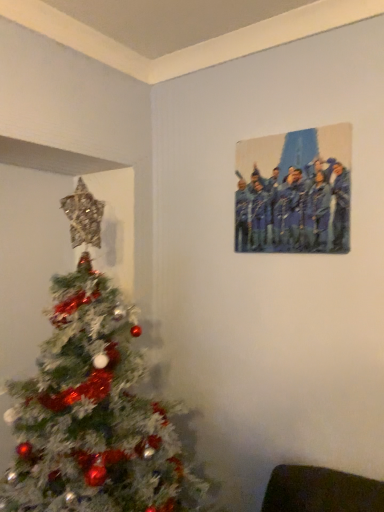
Question: From a real-world perspective, is shiny metallic christmas tree at left physically above metallic blue painting at upper right?

Choices:
 (A) no
 (B) yes

Answer: (A)

Question: Is shiny metallic christmas tree at left smaller than metallic blue painting at upper right?

Choices:
 (A) yes
 (B) no

Answer: (B)

Question: Is metallic blue painting at upper right a part of shiny metallic christmas tree at left?

Choices:
 (A) no
 (B) yes

Answer: (A)

Question: Is shiny metallic christmas tree at left next to metallic blue painting at upper right?

Choices:
 (A) yes
 (B) no

Answer: (B)

Question: From the image's perspective, is shiny metallic christmas tree at left below metallic blue painting at upper right?

Choices:
 (A) yes
 (B) no

Answer: (A)

Question: Does shiny metallic christmas tree at left have a lesser width compared to metallic blue painting at upper right?

Choices:
 (A) yes
 (B) no

Answer: (B)

Question: Is metallic blue painting at upper right positioned far away from shiny metallic christmas tree at left?

Choices:
 (A) no
 (B) yes

Answer: (A)

Question: From a real-world perspective, is metallic blue painting at upper right below shiny metallic christmas tree at left?

Choices:
 (A) yes
 (B) no

Answer: (B)

Question: Considering the relative sizes of metallic blue painting at upper right and shiny metallic christmas tree at left in the image provided, is metallic blue painting at upper right bigger than shiny metallic christmas tree at left?

Choices:
 (A) no
 (B) yes

Answer: (A)

Question: Does metallic blue painting at upper right have a greater height compared to shiny metallic christmas tree at left?

Choices:
 (A) no
 (B) yes

Answer: (A)

Question: Does metallic blue painting at upper right come in front of shiny metallic christmas tree at left?

Choices:
 (A) yes
 (B) no

Answer: (B)

Question: From the image's perspective, is metallic blue painting at upper right beneath shiny metallic christmas tree at left?

Choices:
 (A) yes
 (B) no

Answer: (B)

Question: In the image, is shiny metallic christmas tree at left positioned in front of or behind metallic blue painting at upper right?

Choices:
 (A) behind
 (B) front

Answer: (B)